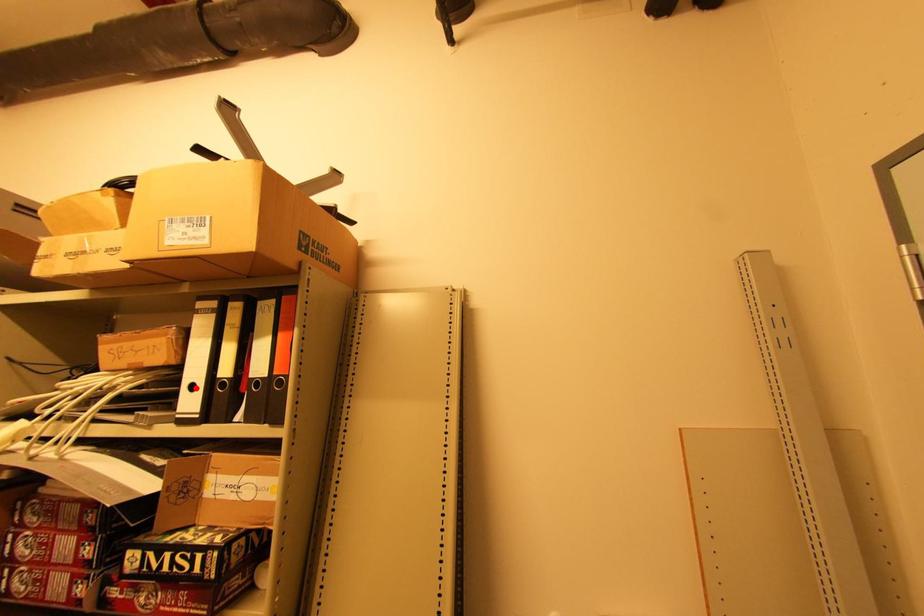
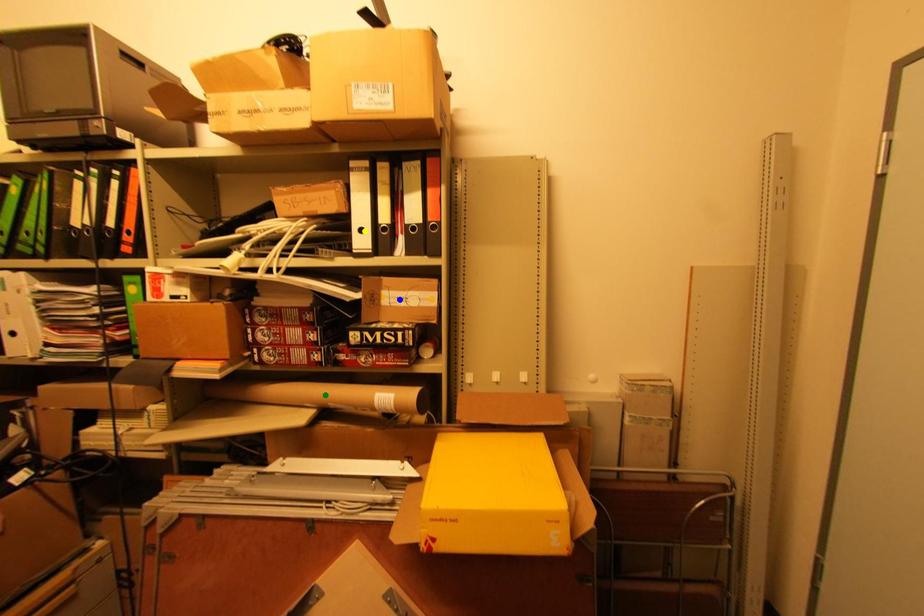
Question: I am providing you with two images of the same scene from different viewpoints. A red point is marked on the first image. You are given multiple points on the second image. Which mark in image 2 goes with the point in image 1?

Choices:
 (A) green point
 (B) blue point
 (C) yellow point

Answer: (C)